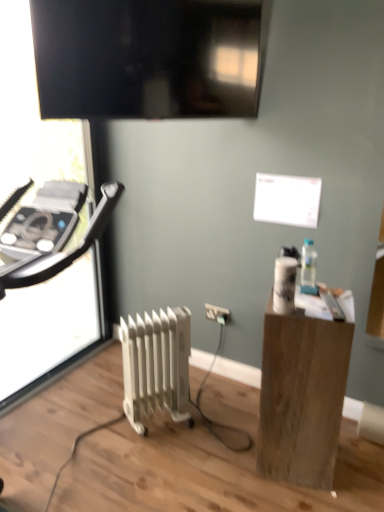
Find the location of a particular element. The image size is (384, 512). free space between wooden block at right and white metallic radiator at center is located at coordinates (204, 444).